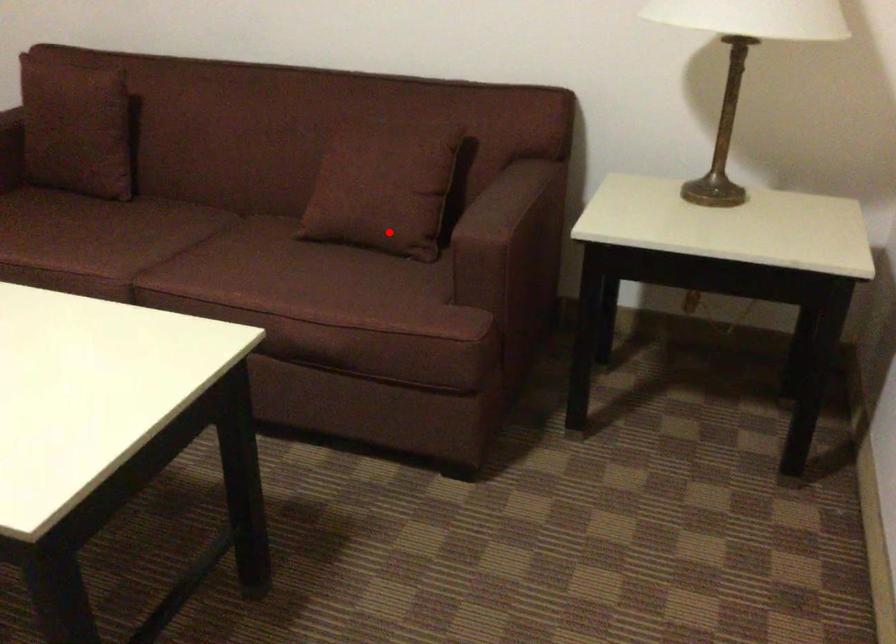
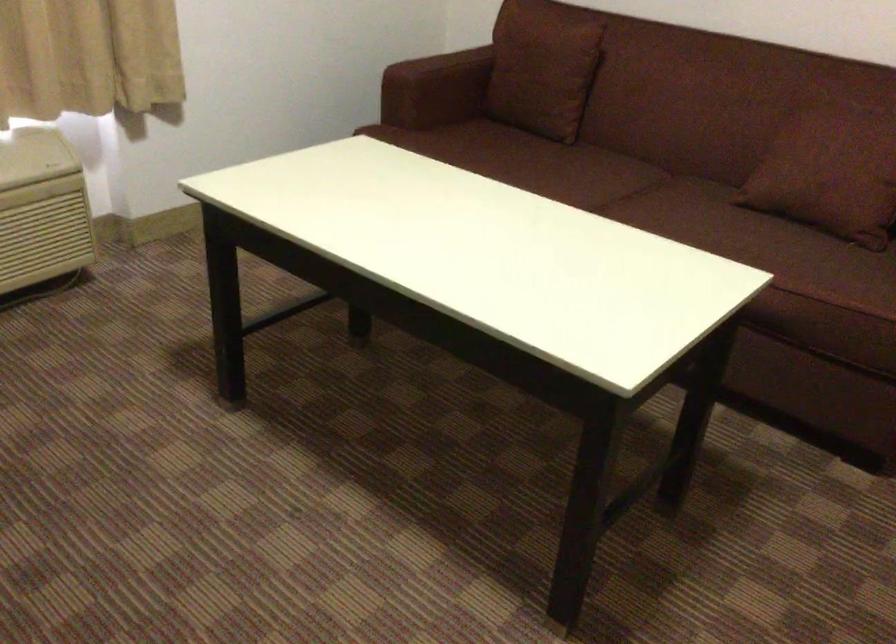
Find the pixel in the second image that matches the highlighted location in the first image.

(842, 207)